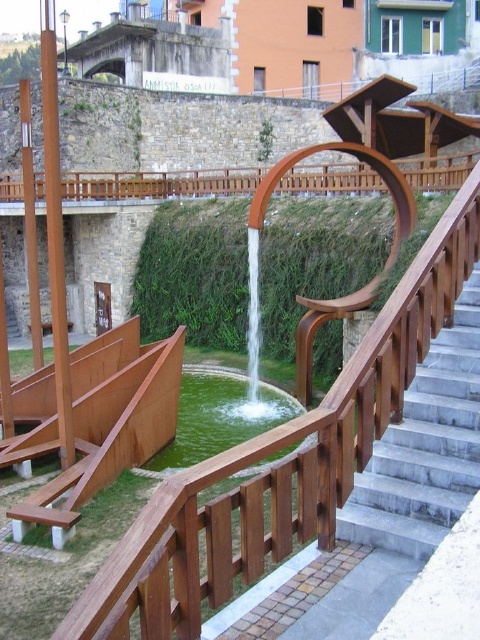
Question: Which point is farther to the camera?

Choices:
 (A) (305, 445)
 (B) (451, 438)

Answer: (A)

Question: Can you confirm if smooth gray concrete stairs at right is smaller than green liquid water at center?

Choices:
 (A) no
 (B) yes

Answer: (B)

Question: Is smooth gray concrete stairs at right thinner than green liquid water at center?

Choices:
 (A) yes
 (B) no

Answer: (A)

Question: Is smooth gray concrete stairs at right positioned behind green liquid water at center?

Choices:
 (A) no
 (B) yes

Answer: (A)

Question: Which point is closer to the camera?

Choices:
 (A) (468, 468)
 (B) (194, 419)

Answer: (A)

Question: Among these points, which one is nearest to the camera?

Choices:
 (A) (452, 422)
 (B) (257, 400)

Answer: (A)